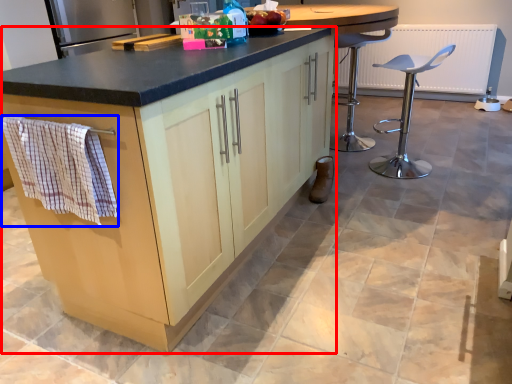
Question: Which object is closer to the camera taking this photo, cabinetry (highlighted by a red box) or hand towel (highlighted by a blue box)?

Choices:
 (A) cabinetry
 (B) hand towel

Answer: (A)